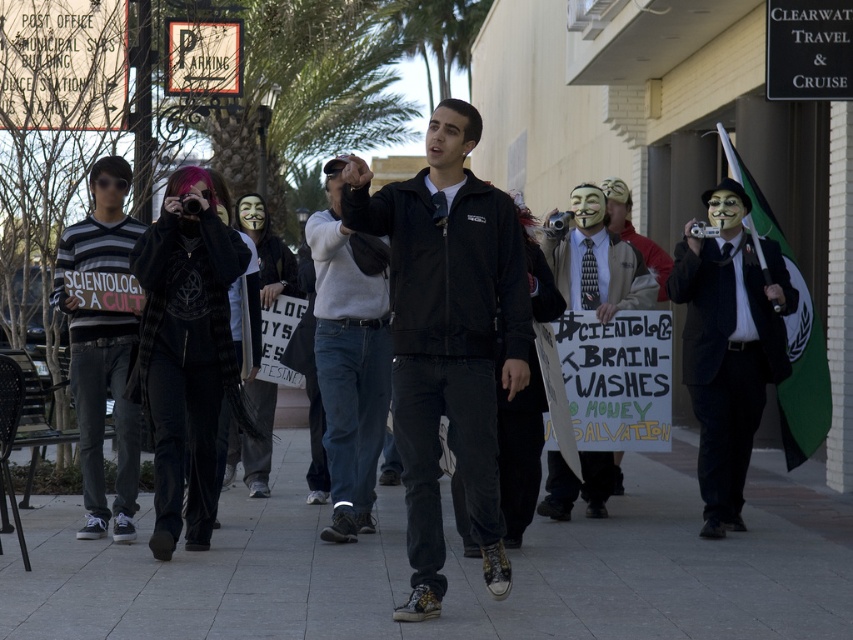
Question: Which point is closer to the camera?

Choices:
 (A) matte black suit at center
 (B) dark gray sweater at center

Answer: (B)

Question: Is black jacket at center smaller than matte black suit at center?

Choices:
 (A) yes
 (B) no

Answer: (B)

Question: Can you confirm if dark gray sweater at center is smaller than matte black suit at center?

Choices:
 (A) yes
 (B) no

Answer: (B)

Question: Which of the following is the closest to the observer?

Choices:
 (A) black jacket at center
 (B) striped sweater at left

Answer: (A)

Question: Estimate the real-world distances between objects in this image. Which object is closer to the striped sweater at left?

Choices:
 (A) matte black suit at center
 (B) dark gray sweater at center
 (C) black jacket at center

Answer: (B)

Question: Does dark gray sweater at center appear on the left side of matte black suit at center?

Choices:
 (A) no
 (B) yes

Answer: (B)